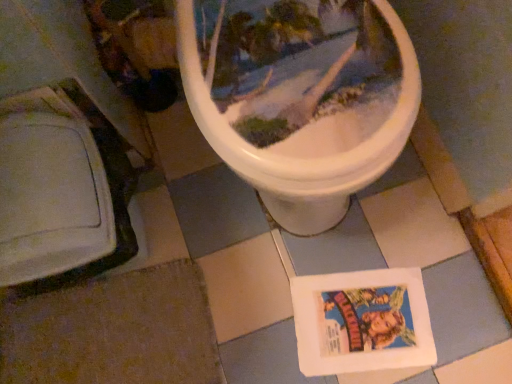
Locate an element on the screen. The width and height of the screenshot is (512, 384). vacant space underneath white paper comic book at lower center (from a real-world perspective) is located at coordinates (351, 314).